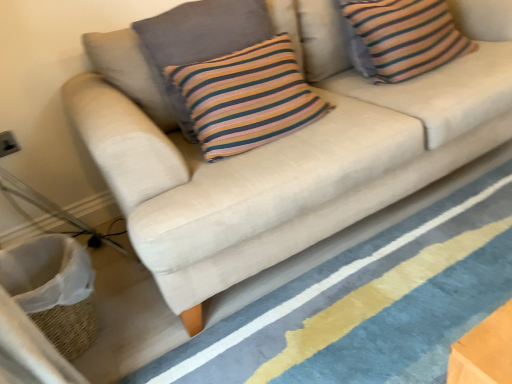
Question: From the image's perspective, does white woven basket at lower left appear higher than beige fabric sofa at lower center?

Choices:
 (A) no
 (B) yes

Answer: (A)

Question: Would you say beige fabric sofa at lower center is part of white woven basket at lower left's contents?

Choices:
 (A) no
 (B) yes

Answer: (A)

Question: Does white woven basket at lower left have a greater height compared to beige fabric sofa at lower center?

Choices:
 (A) no
 (B) yes

Answer: (B)

Question: Considering the relative sizes of white woven basket at lower left and beige fabric sofa at lower center in the image provided, is white woven basket at lower left wider than beige fabric sofa at lower center?

Choices:
 (A) yes
 (B) no

Answer: (B)

Question: Does white woven basket at lower left have a lesser height compared to beige fabric sofa at lower center?

Choices:
 (A) no
 (B) yes

Answer: (A)

Question: Would you say white woven basket at lower left is a long distance from beige fabric sofa at lower center?

Choices:
 (A) yes
 (B) no

Answer: (B)

Question: From a real-world perspective, is knitted cotton pillow at center, marked as the first pillow in a left-to-right arrangement, located beneath beige fabric sofa at lower center?

Choices:
 (A) yes
 (B) no

Answer: (B)

Question: From a real-world perspective, is knitted cotton pillow at center, the 2th pillow in the right-to-left sequence, positioned over beige fabric sofa at lower center based on gravity?

Choices:
 (A) no
 (B) yes

Answer: (B)

Question: Does knitted cotton pillow at center, marked as the first pillow in a left-to-right arrangement, appear on the right side of beige fabric sofa at lower center?

Choices:
 (A) yes
 (B) no

Answer: (B)

Question: Is beige fabric sofa at lower center a part of knitted cotton pillow at center, marked as the first pillow in a left-to-right arrangement?

Choices:
 (A) yes
 (B) no

Answer: (B)

Question: Does knitted cotton pillow at center, the 2th pillow in the right-to-left sequence, come in front of beige fabric sofa at lower center?

Choices:
 (A) no
 (B) yes

Answer: (A)

Question: Is knitted cotton pillow at center, the 2th pillow in the right-to-left sequence, facing towards beige fabric sofa at lower center?

Choices:
 (A) no
 (B) yes

Answer: (A)

Question: Does beige fabric sofa at lower center have a greater width compared to knitted cotton pillow at center, marked as the first pillow in a left-to-right arrangement?

Choices:
 (A) yes
 (B) no

Answer: (A)